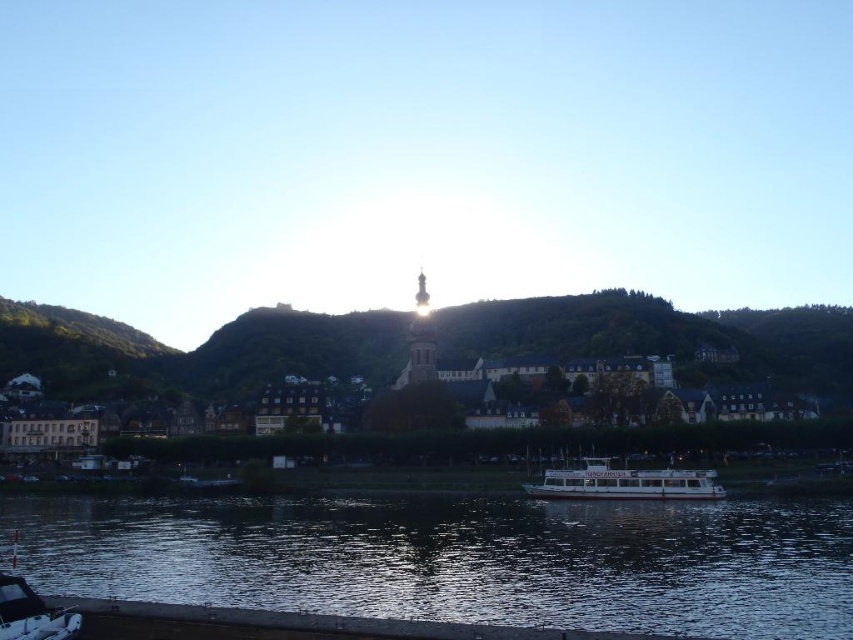
You are standing at the riverside and want to take a photo of the dark reflective water at lower center and the matte stone buildings at center. Which object will appear taller in the photo?

The matte stone buildings at center will appear taller in the photo because the dark reflective water at lower center has a lesser height compared to matte stone buildings at center.

You are standing at the point with coordinates [624,483] and want to board the white glossy boat at lower center. Is the boat accessible from your current position?

The white glossy boat at lower center is located at point [624,483], so you are already at the boat and can board it directly.

You are standing on the dock and see the white glossy boat at lower center and the white plastic boat at lower left. Which boat is positioned to the right side?

The white glossy boat at lower center is positioned to the right of the white plastic boat at lower left.